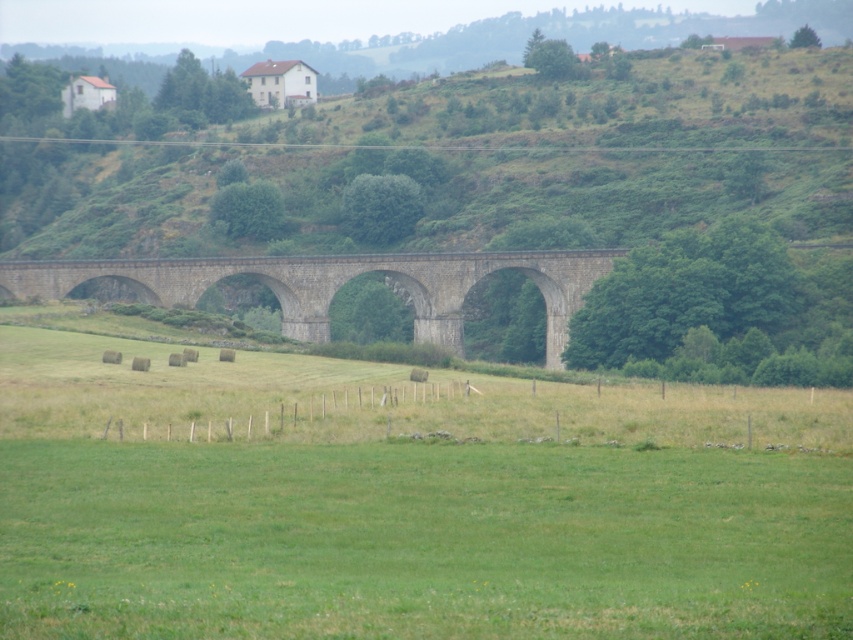
Which is in front, point (73, 452) or point (558, 300)?

Point (73, 452) is more forward.

Is green grassy field at center bigger than gray stone bridge at center?

Incorrect, green grassy field at center is not larger than gray stone bridge at center.

What do you see at coordinates (421, 541) in the screenshot?
I see `green grassy field at center` at bounding box center [421, 541].

Identify the location of green grassy field at center. This screenshot has width=853, height=640. (421, 541).